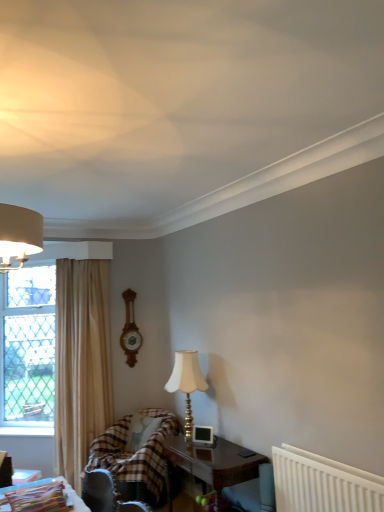
Question: Is clear glass window at left taller than dark wood table at lower center, which is the second table in left-to-right order?

Choices:
 (A) yes
 (B) no

Answer: (A)

Question: From the image's perspective, is clear glass window at left located beneath dark wood table at lower center, marked as the 2th table in a front-to-back arrangement?

Choices:
 (A) yes
 (B) no

Answer: (B)

Question: From the image's perspective, would you say clear glass window at left is positioned over dark wood table at lower center, marked as the 2th table in a front-to-back arrangement?

Choices:
 (A) no
 (B) yes

Answer: (B)

Question: Does clear glass window at left have a larger size compared to dark wood table at lower center, the 1th table ordered from the bottom?

Choices:
 (A) yes
 (B) no

Answer: (A)

Question: Is clear glass window at left positioned beyond the bounds of dark wood table at lower center, the 1th table ordered from the bottom?

Choices:
 (A) no
 (B) yes

Answer: (B)

Question: Can you confirm if clear glass window at left is shorter than dark wood table at lower center, marked as the 2th table in a front-to-back arrangement?

Choices:
 (A) yes
 (B) no

Answer: (B)

Question: Is white fabric lampshade at center-right beside dark wood table at lower center, which is the second table in left-to-right order?

Choices:
 (A) no
 (B) yes

Answer: (A)

Question: From the image's perspective, is white fabric lampshade at center-right under dark wood table at lower center, which is the second table in left-to-right order?

Choices:
 (A) no
 (B) yes

Answer: (A)

Question: Can you confirm if white fabric lampshade at center-right is smaller than dark wood table at lower center, which is counted as the 1th table, starting from the back?

Choices:
 (A) yes
 (B) no

Answer: (A)

Question: Are white fabric lampshade at center-right and dark wood table at lower center, the second table viewed from the top, located far from each other?

Choices:
 (A) yes
 (B) no

Answer: (B)

Question: Considering the relative sizes of white fabric lampshade at center-right and dark wood table at lower center, which is the second table in left-to-right order, in the image provided, is white fabric lampshade at center-right thinner than dark wood table at lower center, which is the second table in left-to-right order,?

Choices:
 (A) no
 (B) yes

Answer: (B)

Question: Is dark wood table at lower center, marked as the 2th table in a front-to-back arrangement, at the back of white fabric lampshade at center-right?

Choices:
 (A) no
 (B) yes

Answer: (A)

Question: Would you say white plastic radiator at lower right is outside dark wood table at lower center, which is the second table in left-to-right order?

Choices:
 (A) no
 (B) yes

Answer: (B)